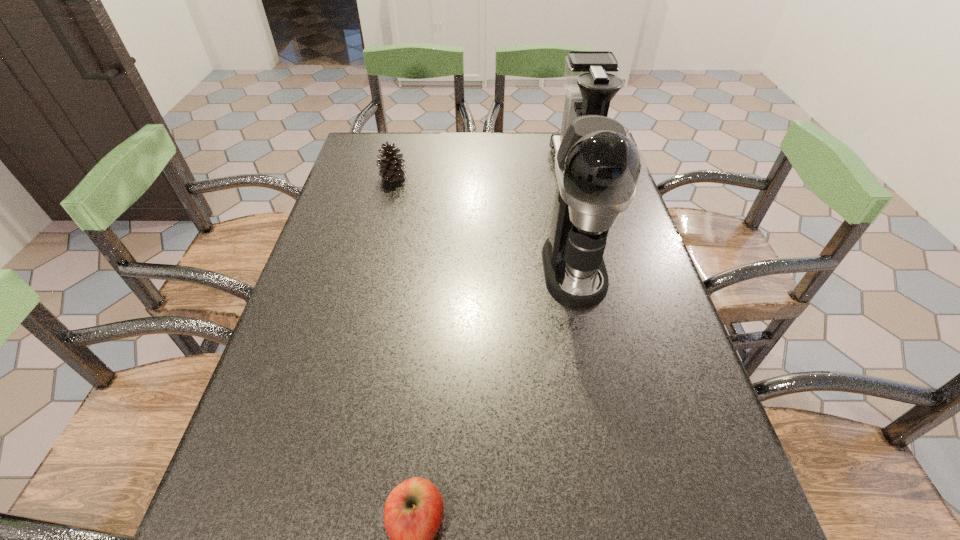
Where is `vacant space located on the right of the leftmost object`? vacant space located on the right of the leftmost object is located at coordinates (537, 177).

This screenshot has height=540, width=960. Identify the location of coffee maker present at the far edge. (591, 81).

Find the location of a particular element. The width and height of the screenshot is (960, 540). pinecone located in the far edge section of the desktop is located at coordinates (392, 169).

I want to click on object that is at the left edge, so click(x=392, y=169).

The width and height of the screenshot is (960, 540). Find the location of `object located in the far left corner section of the desktop`. object located in the far left corner section of the desktop is located at coordinates (392, 169).

Where is `object that is positioned at the far right corner`? object that is positioned at the far right corner is located at coordinates (591, 81).

This screenshot has height=540, width=960. Find the location of `vacant region at the far edge of the desktop`. vacant region at the far edge of the desktop is located at coordinates pos(434,139).

The height and width of the screenshot is (540, 960). What are the coordinates of `vacant area at the left edge of the desktop` in the screenshot? It's located at (293, 462).

The width and height of the screenshot is (960, 540). In the image, there is a desktop. What are the coordinates of `free space at the right edge` in the screenshot? It's located at (634, 264).

Identify the location of vacant area between the leftmost object and the shorter coffee maker. (486, 173).